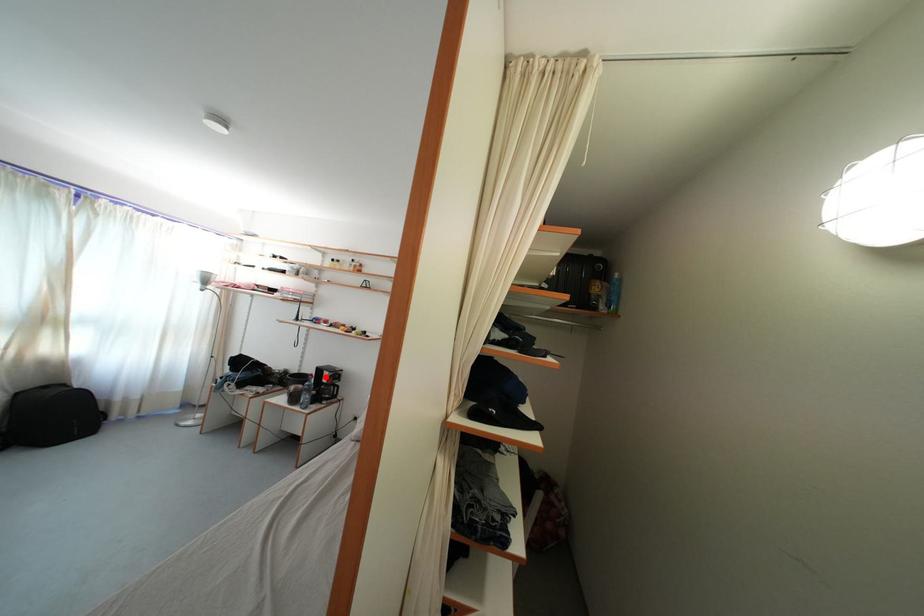
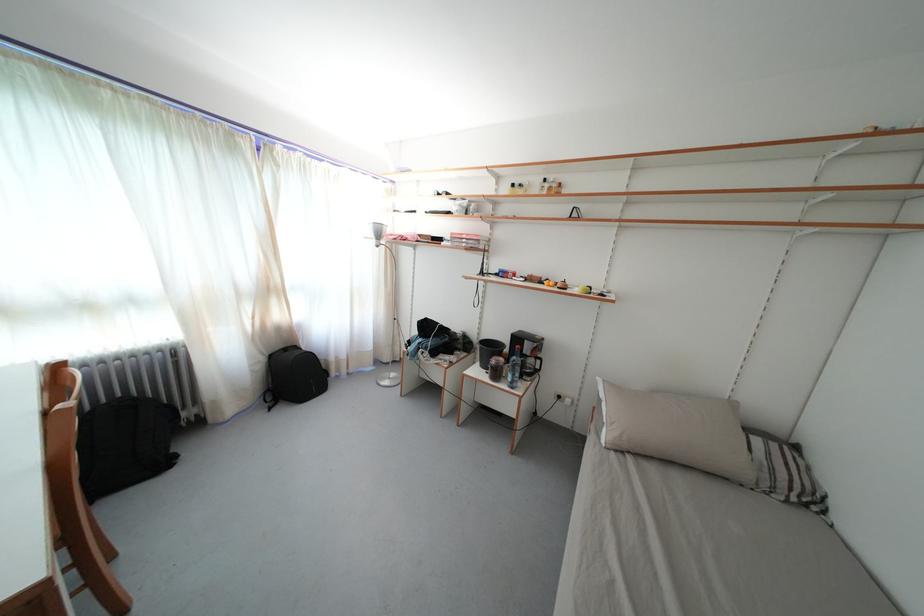
Where in the second image is the point corresponding to the highlighted location from the first image?

(524, 345)